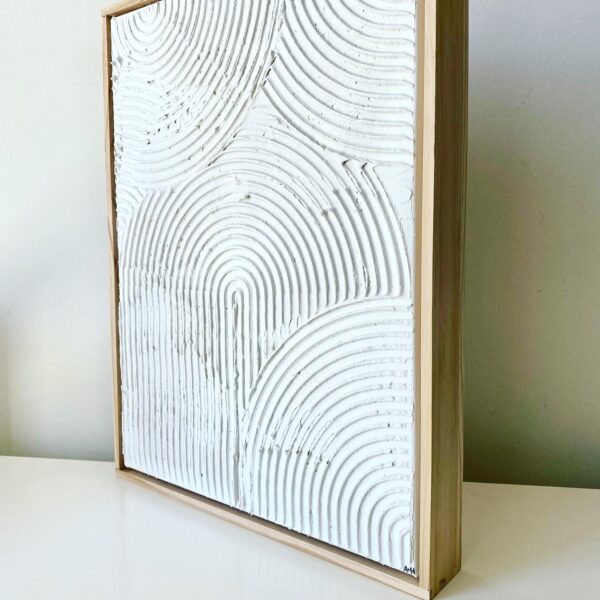
This screenshot has width=600, height=600. I want to click on lighted part of wall, so click(x=66, y=239), click(x=71, y=335).